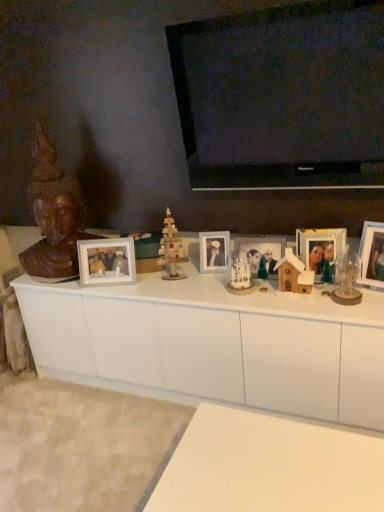
You are a GUI agent. You are given a task and a screenshot of the screen. Output one action in this format:
    pyautogui.click(x=<x>, y=<y>)
    Task: Click on the free space between white ceramic snowman at center, which is the 2th toy in left-to-right order, and wooden christmas tree at center, arranged as the first toy when viewed from the left
    The width and height of the screenshot is (384, 512).
    Given the screenshot: What is the action you would take?
    pyautogui.click(x=201, y=284)